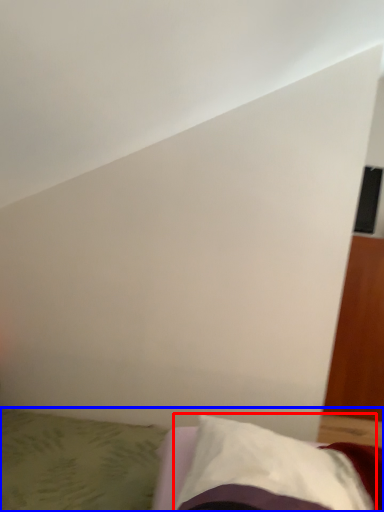
Question: Which point is closer to the camera, pillow (highlighted by a red box) or bed (highlighted by a blue box)?

Choices:
 (A) pillow
 (B) bed

Answer: (A)